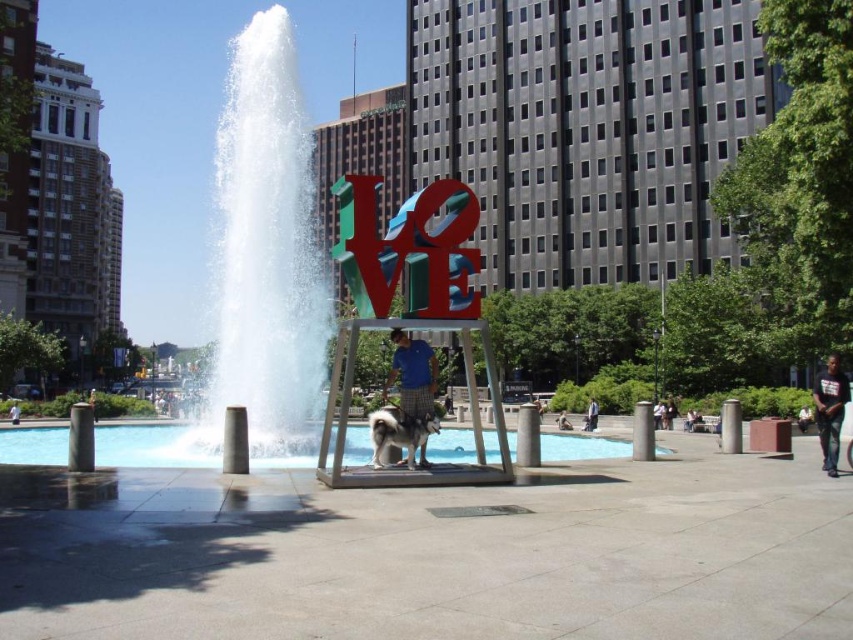
Does white fluffy dog at center lie in front of light blue jeans at center?

That is True.

Can you confirm if white fluffy dog at center is smaller than light blue jeans at center?

No, white fluffy dog at center is not smaller than light blue jeans at center.

Who is more forward, (416, 420) or (595, 403)?

Point (416, 420)

Image resolution: width=853 pixels, height=640 pixels. Identify the location of white fluffy dog at center. (399, 432).

Is point (592, 403) closer to viewer compared to point (93, 406)?

No, (592, 403) is further to viewer.

Can you confirm if light blue jeans at center is smaller than matte blue shirt at center?

Yes.

Find the location of a particular element. The image size is (853, 640). light blue jeans at center is located at coordinates click(590, 413).

Can you confirm if blue cotton shirt at center is smaller than matte blue shirt at center?

Indeed, blue cotton shirt at center has a smaller size compared to matte blue shirt at center.

Image resolution: width=853 pixels, height=640 pixels. What do you see at coordinates (412, 374) in the screenshot? I see `blue cotton shirt at center` at bounding box center [412, 374].

You are a GUI agent. You are given a task and a screenshot of the screen. Output one action in this format:
    pyautogui.click(x=<x>, y=<y>)
    Task: Click on the blue cotton shirt at center
    This screenshot has height=640, width=853.
    Given the screenshot: What is the action you would take?
    pyautogui.click(x=412, y=374)